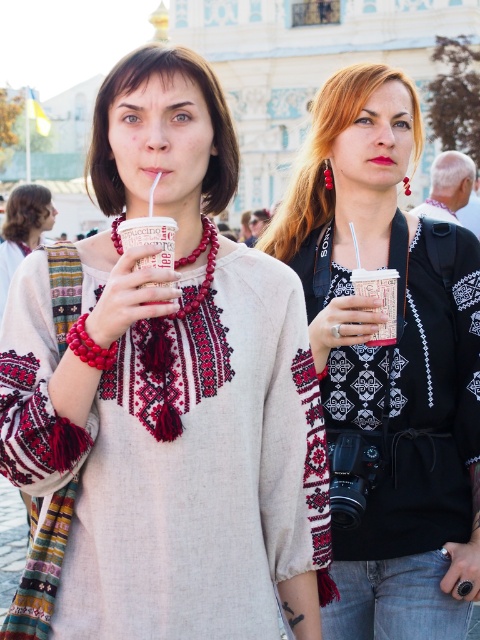
Question: Can you confirm if matte black scarf at center is positioned below white paper cup at center?

Choices:
 (A) yes
 (B) no

Answer: (A)

Question: Which point is farther from the camera taking this photo?

Choices:
 (A) (171, 224)
 (B) (41, 204)
 (C) (240, 509)
 (D) (344, 566)

Answer: (B)

Question: Which point is farther to the camera?

Choices:
 (A) (14, 227)
 (B) (274, 410)
 (C) (433, 394)
 (D) (171, 266)

Answer: (A)

Question: Among these objects, which one is nearest to the camera?

Choices:
 (A) matte red scarf at left
 (B) matte black scarf at center
 (C) white paper cup at center

Answer: (C)

Question: Considering the relative positions of matte black scarf at center and white paper cup at center in the image provided, where is matte black scarf at center located with respect to white paper cup at center?

Choices:
 (A) above
 (B) below

Answer: (B)

Question: Is matte red scarf at left to the right of white paper cup at center from the viewer's perspective?

Choices:
 (A) no
 (B) yes

Answer: (A)